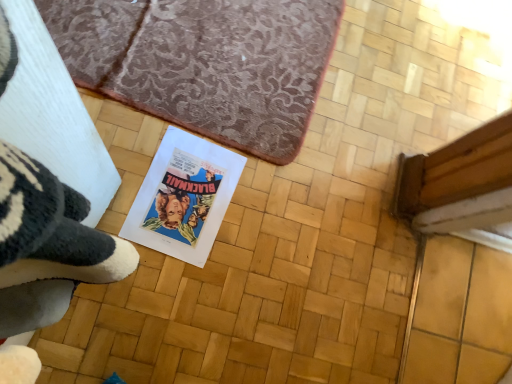
Describe the element at coordinates (183, 197) in the screenshot. I see `matte paper book at center` at that location.

Locate an element on the screen. The width and height of the screenshot is (512, 384). matte paper book at center is located at coordinates (183, 197).

This screenshot has height=384, width=512. Describe the element at coordinates (205, 62) in the screenshot. I see `brown textured rug at upper center` at that location.

Measure the distance between brown textured rug at upper center and camera.

brown textured rug at upper center and camera are 1.01 meters apart from each other.

The image size is (512, 384). Identify the location of brown textured rug at upper center. (205, 62).

You are a GUI agent. You are given a task and a screenshot of the screen. Output one action in this format:
    pyautogui.click(x=<x>, y=<y>)
    Task: Click on the matte paper book at center
    This screenshot has width=512, height=384.
    Given the screenshot: What is the action you would take?
    pyautogui.click(x=183, y=197)

Which is more to the left, brown textured rug at upper center or matte paper book at center?

From the viewer's perspective, matte paper book at center appears more on the left side.

Does brown textured rug at upper center lie in front of matte paper book at center?

No, the depth of brown textured rug at upper center is greater than that of matte paper book at center.

Considering the points (324, 16) and (144, 216), which point is behind, point (324, 16) or point (144, 216)?

Positioned behind is point (324, 16).

From the image's perspective, would you say brown textured rug at upper center is shown under matte paper book at center?

No, from the image's perspective, brown textured rug at upper center is not below matte paper book at center.

From a real-world perspective, is brown textured rug at upper center above or below matte paper book at center?

brown textured rug at upper center is above matte paper book at center.

Does brown textured rug at upper center have a greater width compared to matte paper book at center?

Indeed, brown textured rug at upper center has a greater width compared to matte paper book at center.

From their relative heights in the image, would you say brown textured rug at upper center is taller or shorter than matte paper book at center?

Considering their sizes, brown textured rug at upper center has more height than matte paper book at center.

Can you confirm if brown textured rug at upper center is smaller than matte paper book at center?

Incorrect, brown textured rug at upper center is not smaller in size than matte paper book at center.

Is brown textured rug at upper center positioned beyond the bounds of matte paper book at center?

Yes, brown textured rug at upper center is outside of matte paper book at center.

Is there a large distance between brown textured rug at upper center and matte paper book at center?

brown textured rug at upper center is near matte paper book at center, not far away.

Could you tell me if brown textured rug at upper center is facing matte paper book at center?

No, brown textured rug at upper center is not aimed at matte paper book at center.

The height and width of the screenshot is (384, 512). Identify the location of paperback book below the brown textured rug at upper center (from a real-world perspective). (183, 197).

Which is more to the left, matte paper book at center or brown textured rug at upper center?

matte paper book at center.

Between matte paper book at center and brown textured rug at upper center, which one is positioned in front?

matte paper book at center is closer to the camera.

Which point is more distant from viewer, (138, 242) or (94, 74)?

The point (94, 74) is farther from the camera.

From the image's perspective, is matte paper book at center above or below brown textured rug at upper center?

From the image's perspective, matte paper book at center appears below brown textured rug at upper center.

From a real-world perspective, is matte paper book at center on top of brown textured rug at upper center?

Incorrect, from a real-world perspective, matte paper book at center is lower than brown textured rug at upper center.

Based on the photo, can you confirm if matte paper book at center is wider than brown textured rug at upper center?

Incorrect, the width of matte paper book at center does not surpass that of brown textured rug at upper center.

Between matte paper book at center and brown textured rug at upper center, which one has more height?

brown textured rug at upper center.

Considering the sizes of objects matte paper book at center and brown textured rug at upper center in the image provided, who is bigger, matte paper book at center or brown textured rug at upper center?

With larger size is brown textured rug at upper center.

Would you say matte paper book at center is inside or outside brown textured rug at upper center?

matte paper book at center is outside brown textured rug at upper center.

Would you consider matte paper book at center to be distant from brown textured rug at upper center?

No, there isn't a large distance between matte paper book at center and brown textured rug at upper center.

Consider the image. Does matte paper book at center turn towards brown textured rug at upper center?

No, matte paper book at center is not turned towards brown textured rug at upper center.

How different are the orientations of matte paper book at center and brown textured rug at upper center in degrees?

The angular difference between matte paper book at center and brown textured rug at upper center is 178 degrees.

I want to click on bath mat behind the matte paper book at center, so pyautogui.click(x=205, y=62).

Locate an element on the screen. The width and height of the screenshot is (512, 384). paperback book lying on the left of brown textured rug at upper center is located at coordinates (183, 197).

Identify the location of bath mat that appears behind the matte paper book at center. The height and width of the screenshot is (384, 512). (205, 62).